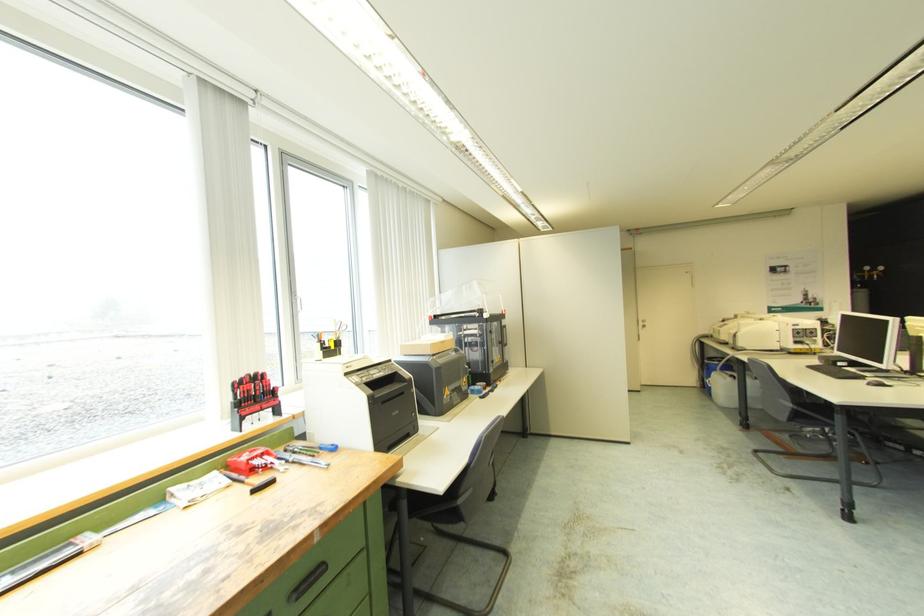
I want to click on white plastic canister, so click(733, 389).